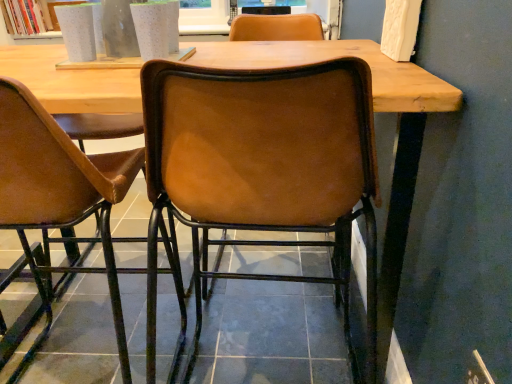
Question: Is brown leather chair at center, which ranks as the 2th chair in right-to-left order, bigger than leather at center, the 2th chair viewed from the left?

Choices:
 (A) no
 (B) yes

Answer: (B)

Question: Can you confirm if brown leather chair at center, which ranks as the 2th chair in right-to-left order, is wider than leather at center, the 2th chair viewed from the left?

Choices:
 (A) no
 (B) yes

Answer: (B)

Question: Is brown leather chair at center, which ranks as the 2th chair in right-to-left order, next to leather at center, the 2th chair viewed from the left, and touching it?

Choices:
 (A) no
 (B) yes

Answer: (A)

Question: Is brown leather chair at center, the 1th chair in the left-to-right sequence, facing towards leather at center, which appears as the 1th chair when viewed from the right?

Choices:
 (A) yes
 (B) no

Answer: (B)

Question: Is brown leather chair at center, the 1th chair in the left-to-right sequence, smaller than leather at center, which appears as the 1th chair when viewed from the right?

Choices:
 (A) yes
 (B) no

Answer: (B)

Question: Is there a large distance between leather at center, the 2th chair viewed from the left, and brown leather chair at center, which ranks as the 2th chair in right-to-left order?

Choices:
 (A) yes
 (B) no

Answer: (B)

Question: From the image's perspective, does leather at center, the 2th chair viewed from the left, appear higher than brown leather chair at center, which ranks as the 2th chair in right-to-left order?

Choices:
 (A) yes
 (B) no

Answer: (B)

Question: Is leather at center, the 2th chair viewed from the left, turned away from brown leather chair at center, the 1th chair in the left-to-right sequence?

Choices:
 (A) no
 (B) yes

Answer: (A)

Question: Is leather at center, which appears as the 1th chair when viewed from the right, in contact with brown leather chair at center, the 1th chair in the left-to-right sequence?

Choices:
 (A) yes
 (B) no

Answer: (B)

Question: Is leather at center, which appears as the 1th chair when viewed from the right, outside of brown leather chair at center, the 1th chair in the left-to-right sequence?

Choices:
 (A) no
 (B) yes

Answer: (B)

Question: From the image's perspective, is leather at center, which appears as the 1th chair when viewed from the right, located beneath brown leather chair at center, the 1th chair in the left-to-right sequence?

Choices:
 (A) no
 (B) yes

Answer: (B)

Question: From a real-world perspective, is leather at center, which appears as the 1th chair when viewed from the right, physically located above or below brown leather chair at center, which ranks as the 2th chair in right-to-left order?

Choices:
 (A) above
 (B) below

Answer: (A)